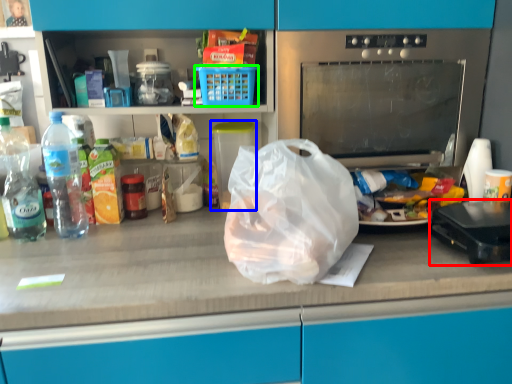
Question: Estimate the real-world distances between objects in this image. Which object is closer to kitchen appliance (highlighted by a red box), appliance (highlighted by a blue box) or basket (highlighted by a green box)?

Choices:
 (A) appliance
 (B) basket

Answer: (B)